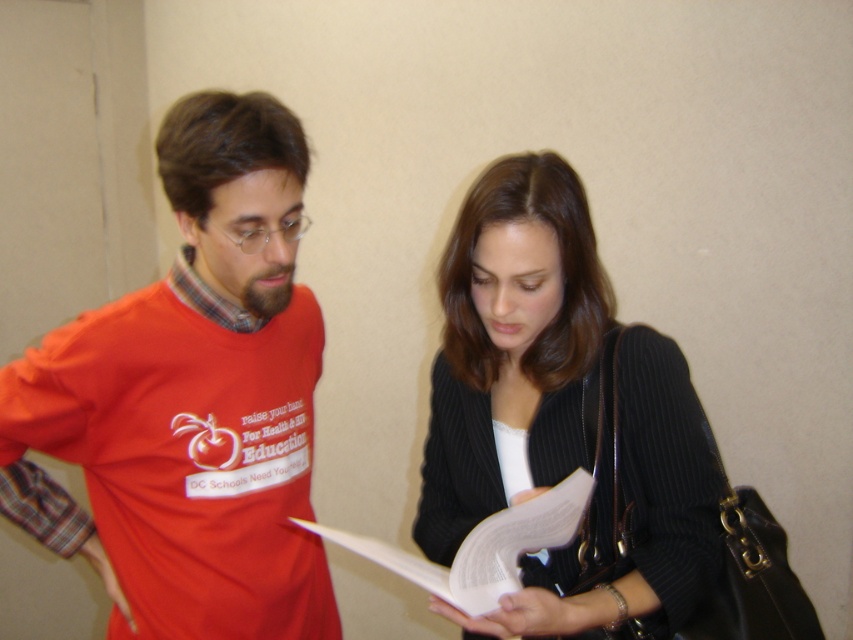
Is the position of black ribbed sweater at center more distant than that of white paper at center?

Yes, it is behind white paper at center.

Does black ribbed sweater at center have a lesser width compared to white paper at center?

Incorrect, black ribbed sweater at center's width is not less than white paper at center's.

At what (x,y) coordinates should I click in order to perform the action: click on black ribbed sweater at center. Please return your answer as a coordinate pair (x, y). The height and width of the screenshot is (640, 853). Looking at the image, I should click on (509, 344).

Can you confirm if matte orange t-shirt at center is smaller than black ribbed sweater at center?

Actually, matte orange t-shirt at center might be larger than black ribbed sweater at center.

Is matte orange t-shirt at center wider than black ribbed sweater at center?

Yes.

The width and height of the screenshot is (853, 640). I want to click on matte orange t-shirt at center, so click(x=198, y=394).

Locate an element on the screen. The width and height of the screenshot is (853, 640). matte orange t-shirt at center is located at coordinates (198, 394).

Does point (219, 564) come behind point (532, 525)?

Yes, it is behind point (532, 525).

Does matte orange t-shirt at center have a smaller size compared to white paper at center?

Incorrect, matte orange t-shirt at center is not smaller in size than white paper at center.

Is point (242, 412) positioned in front of point (374, 557)?

No, it is behind (374, 557).

At what (x,y) coordinates should I click in order to perform the action: click on matte orange t-shirt at center. Please return your answer as a coordinate pair (x, y). This screenshot has height=640, width=853. Looking at the image, I should click on (198, 394).